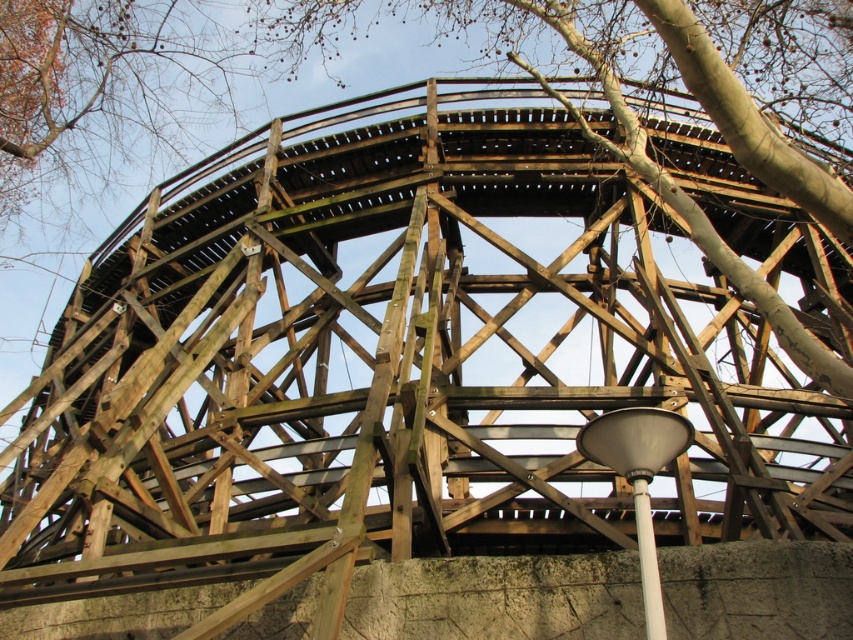
You are standing at the base of the wooden roller coaster structure and see the point at coordinates (671, 96). What object is located at that point?

The point at coordinates (671, 96) corresponds to the brown wood tree at center.

You are a maintenance worker inspecting the wooden roller coaster structure. You notice a brown wood tree at center growing near the track. Based on its position at coordinates point 0.150, 0.788, is it within the safety zone defined as the area within 0.2 units from the track centerline?

The brown wood tree at center is located at point (671, 96). Since the safety zone is within 0.2 units from the track centerline, the tree is within the safety zone as its coordinates fall within that range.

You are a park visitor standing at the base of the brown wood tree at center and the white plastic pole at lower center. Which object is taller?

The brown wood tree at center is taller than the white plastic pole at lower center.